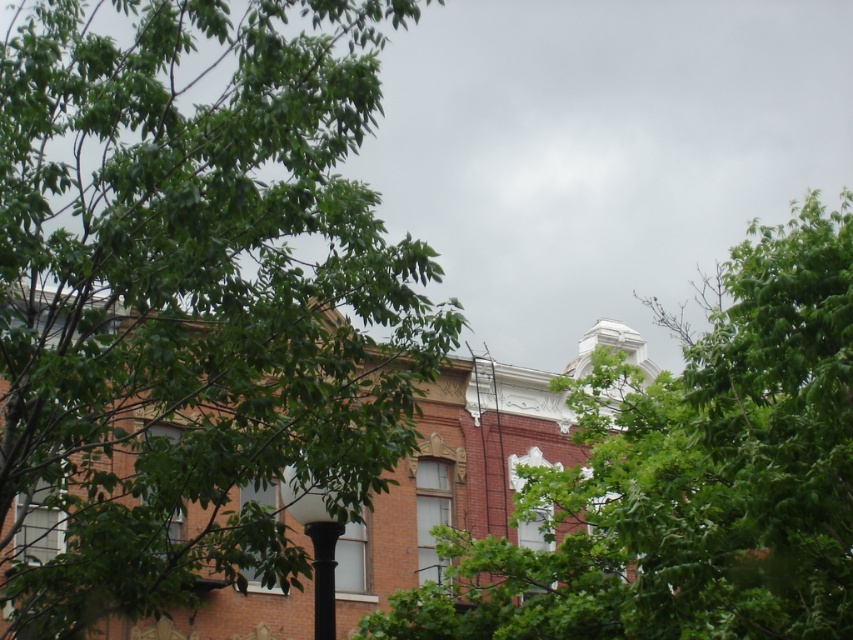
You are an architect designing a garden layout and need to know the relative sizes of the trees to plan spacing. Which tree, the green leafy tree at upper left or the green leafy tree at upper center, requires more space due to its size?

The green leafy tree at upper left requires more space because it is bigger than the green leafy tree at upper center according to the description.